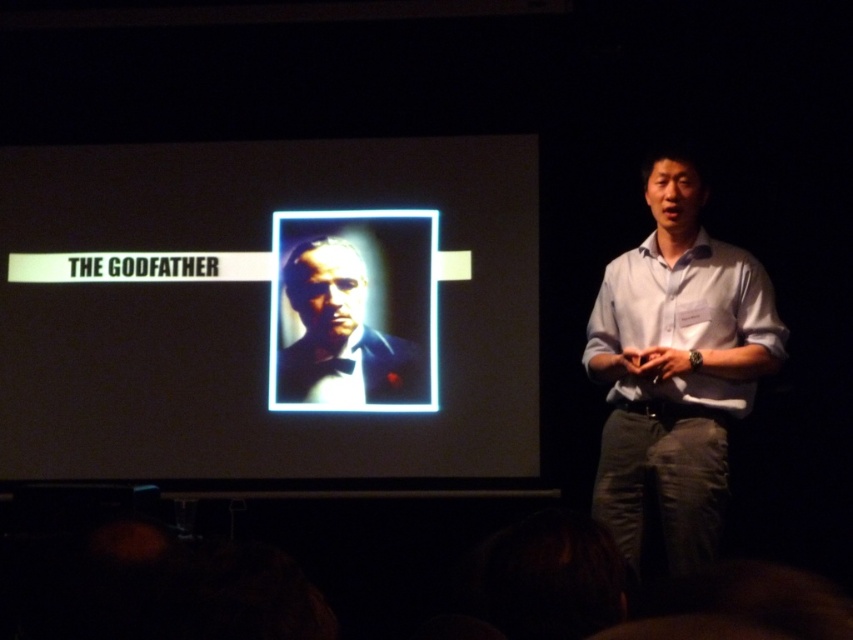
Is white cotton shirt at right wider than matte black suit at center?

No.

Does white cotton shirt at right have a smaller size compared to matte black suit at center?

Incorrect, white cotton shirt at right is not smaller in size than matte black suit at center.

Which is in front, point (631, 307) or point (321, 384)?

Point (631, 307)

Where is `white cotton shirt at right`? white cotton shirt at right is located at coordinates (685, 320).

Does matte black frame at center come in front of white shirt at center?

No, matte black frame at center is further to the viewer.

Which is below, matte black frame at center or white shirt at center?

Positioned lower is white shirt at center.

What are the coordinates of `matte black frame at center` in the screenshot? It's located at click(270, 310).

Who is more forward, (735,266) or (332,400)?

Positioned in front is point (735,266).

Which is behind, point (677, 340) or point (358, 252)?

Point (358, 252)

I want to click on white shirt at center, so click(676, 369).